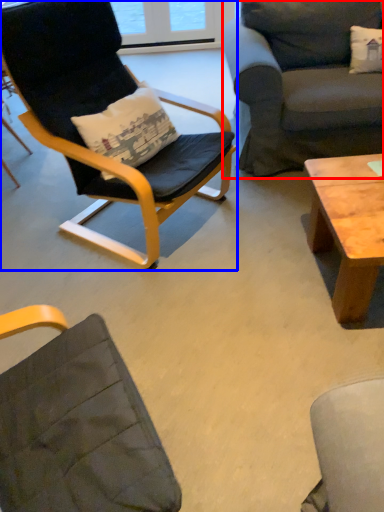
Question: Which object is further to the camera taking this photo, studio couch (highlighted by a red box) or chair (highlighted by a blue box)?

Choices:
 (A) studio couch
 (B) chair

Answer: (A)